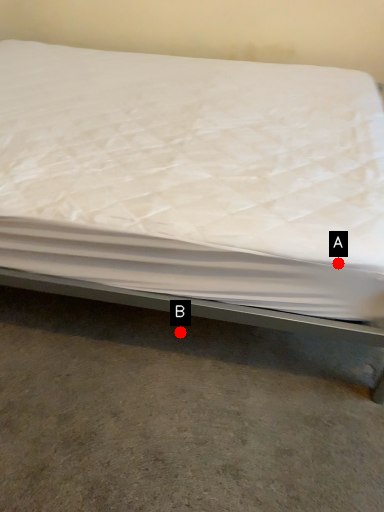
Question: Two points are circled on the image, labeled by A and B beside each circle. Among these points, which one is nearest to the camera?

Choices:
 (A) A is closer
 (B) B is closer

Answer: (A)